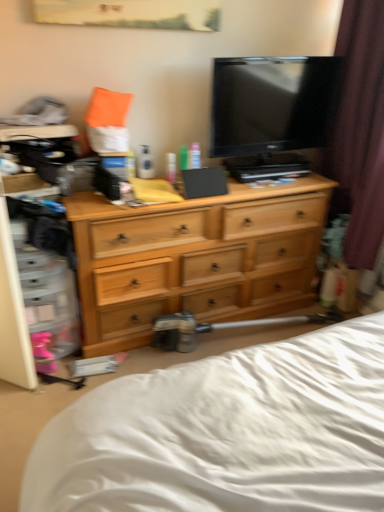
Question: Is brown velvet curtain at right located within light wood dresser at center?

Choices:
 (A) yes
 (B) no

Answer: (B)

Question: Is light wood dresser at center bigger than brown velvet curtain at right?

Choices:
 (A) no
 (B) yes

Answer: (B)

Question: Can you confirm if light wood dresser at center is thinner than brown velvet curtain at right?

Choices:
 (A) yes
 (B) no

Answer: (B)

Question: Considering the relative sizes of light wood dresser at center and brown velvet curtain at right in the image provided, is light wood dresser at center shorter than brown velvet curtain at right?

Choices:
 (A) yes
 (B) no

Answer: (A)

Question: Is light wood dresser at center at the right side of brown velvet curtain at right?

Choices:
 (A) yes
 (B) no

Answer: (B)

Question: Considering the positions of white soft bed at lower center and light wood dresser at center in the image, is white soft bed at lower center wider or thinner than light wood dresser at center?

Choices:
 (A) thin
 (B) wide

Answer: (B)

Question: In terms of size, does white soft bed at lower center appear bigger or smaller than light wood dresser at center?

Choices:
 (A) small
 (B) big

Answer: (B)

Question: Do you think white soft bed at lower center is within light wood dresser at center, or outside of it?

Choices:
 (A) outside
 (B) inside

Answer: (A)

Question: From the image's perspective, is white soft bed at lower center located above or below light wood dresser at center?

Choices:
 (A) above
 (B) below

Answer: (B)

Question: Which is correct: black glossy tv at upper center is inside green plastic bottle at center, the 2th toiletry from the right, or outside of it?

Choices:
 (A) inside
 (B) outside

Answer: (B)

Question: From the image's perspective, is black glossy tv at upper center positioned above or below green plastic bottle at center, the 2th toiletry from the right?

Choices:
 (A) above
 (B) below

Answer: (A)

Question: Considering the relative positions of black glossy tv at upper center and green plastic bottle at center, the first toiletry positioned from the left, in the image provided, is black glossy tv at upper center to the left or to the right of green plastic bottle at center, the first toiletry positioned from the left,?

Choices:
 (A) right
 (B) left

Answer: (A)

Question: In terms of width, does black glossy tv at upper center look wider or thinner when compared to green plastic bottle at center, the 2th toiletry from the right?

Choices:
 (A) thin
 (B) wide

Answer: (B)

Question: Is brown velvet curtain at right taller or shorter than translucent plastic tube at center, the second toiletry viewed from the left?

Choices:
 (A) tall
 (B) short

Answer: (A)

Question: Based on their sizes in the image, would you say brown velvet curtain at right is bigger or smaller than translucent plastic tube at center, the second toiletry viewed from the left?

Choices:
 (A) small
 (B) big

Answer: (B)